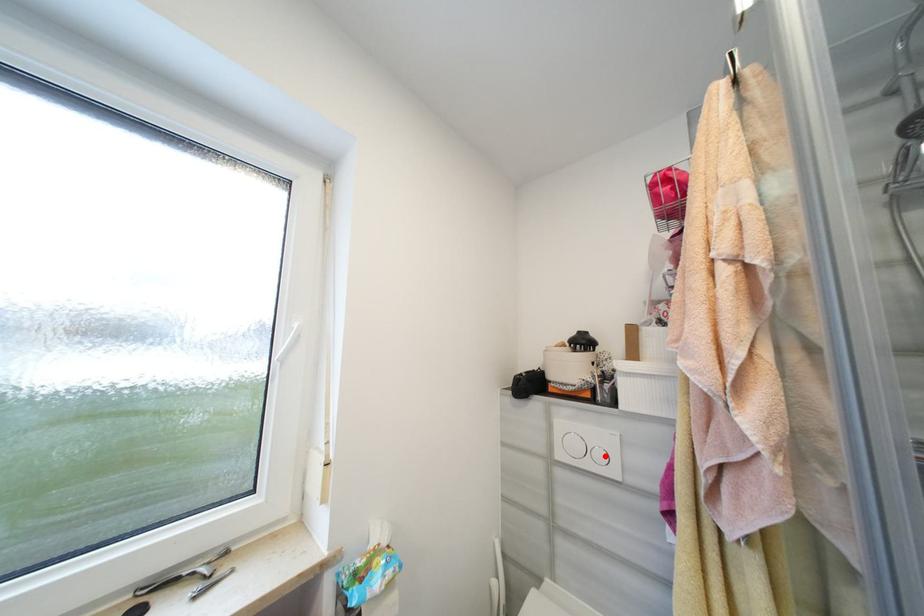
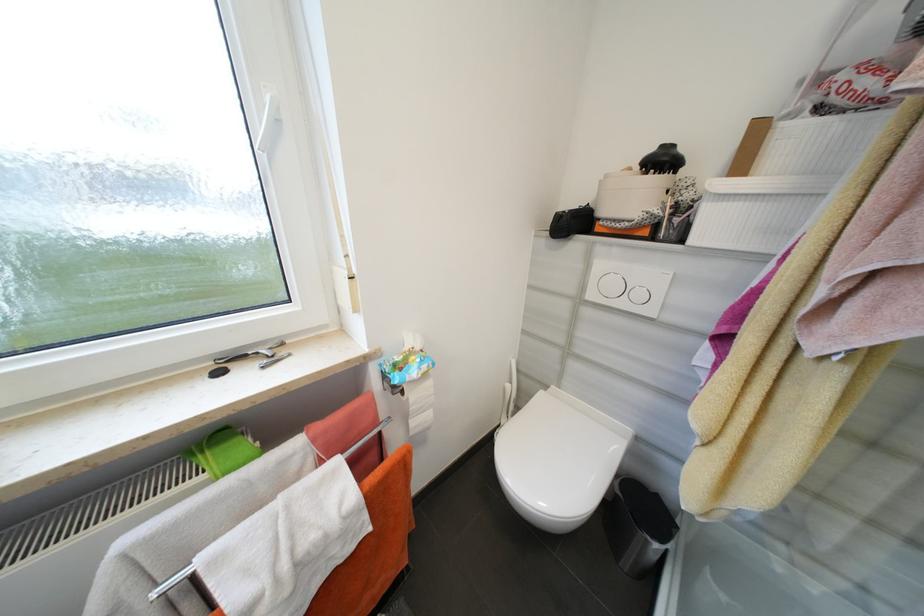
Question: I am providing you with two images of the same scene from different viewpoints. A red point is marked on the first image. Is the red point's position out of view in image 2?

Choices:
 (A) Yes
 (B) No

Answer: (B)